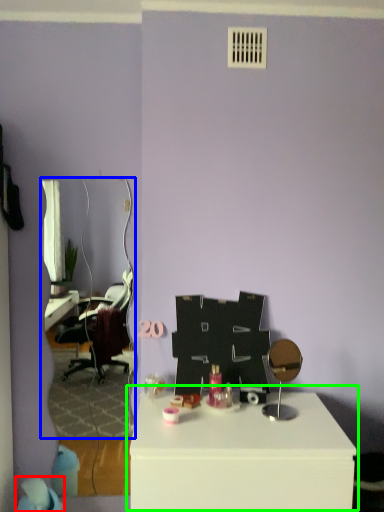
Question: Considering the real-world distances, which object is farthest from bean bag chair (highlighted by a red box)? mirror (highlighted by a blue box) or table (highlighted by a green box)?

Choices:
 (A) mirror
 (B) table

Answer: (A)